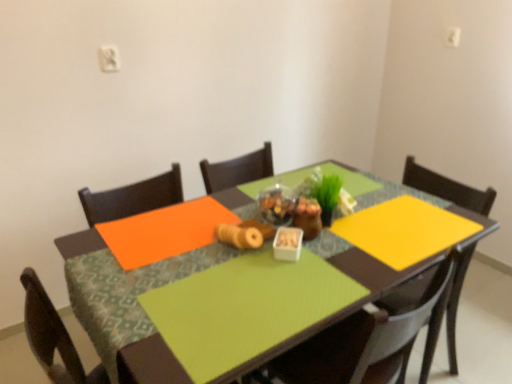
Measure the distance between matte brown chair at center and camera.

They are 34.06 inches apart.

I want to click on white matte container at center, so click(x=287, y=244).

What do you see at coordinates (325, 189) in the screenshot? I see `green matte plant at center` at bounding box center [325, 189].

Where is `matte brown chair at center`? Image resolution: width=512 pixels, height=384 pixels. matte brown chair at center is located at coordinates (365, 342).

Which object is positioned more to the left, matte brown chair at center or green matte plant at center?

green matte plant at center is more to the left.

Does matte brown chair at center lie in front of green matte plant at center?

That is True.

Which of these two, matte brown chair at center or green matte plant at center, is smaller?

green matte plant at center is smaller.

From a real-world perspective, which object rests below the other?

From a 3D spatial view, white matte container at center is below.

I want to click on tableware that is on the left side of green matte plant at center, so click(287, 244).

Who is taller, green matte plant at center or white matte container at center?

green matte plant at center is taller.

How much distance is there between green matte plant at center and white matte container at center?

green matte plant at center and white matte container at center are 17.67 centimeters apart from each other.

From a real-world perspective, which is physically above, matte brown chair at center or green fabric table at center?

matte brown chair at center is physically above.

From the image's perspective, between matte brown chair at center and green fabric table at center, who is located below?

matte brown chair at center.

Do you think matte brown chair at center is within green fabric table at center, or outside of it?

matte brown chair at center exists entirely within green fabric table at center.

Which is behind, point (335, 374) or point (146, 342)?

Point (335, 374)

The image size is (512, 384). I want to click on plant above the green fabric table at center (from the image's perspective), so [325, 189].

In the image, is green matte plant at center positioned in front of or behind green fabric table at center?

green matte plant at center is positioned farther from the viewer than green fabric table at center.

Could you tell me if green matte plant at center is facing green fabric table at center?

No, green matte plant at center is not facing towards green fabric table at center.

Can you see white matte container at center touching green matte plant at center?

No, white matte container at center is not next to green matte plant at center.

How different are the orientations of white matte container at center and green matte plant at center in degrees?

The facing directions of white matte container at center and green matte plant at center are 17.6 degrees apart.

Consider the image. Does white matte container at center have a greater height compared to green matte plant at center?

Incorrect, the height of white matte container at center is not larger of that of green matte plant at center.

Could you tell me if white matte container at center is turned towards green matte plant at center?

No, white matte container at center does not turn towards green matte plant at center.

Is green fabric table at center facing away from matte brown chair at center?

Yes, matte brown chair at center is at the back of green fabric table at center.

Locate an element on the screen. chair above the green fabric table at center (from a real-world perspective) is located at coordinates (365, 342).

Which object is more forward, green fabric table at center or matte brown chair at center?

green fabric table at center is more forward.

Does green fabric table at center appear on the left side of matte brown chair at center?

Indeed, green fabric table at center is positioned on the left side of matte brown chair at center.

Consider the image. From the image's perspective, which is below, green matte plant at center or matte brown chair at center?

matte brown chair at center, from the image's perspective.

Considering the sizes of objects green matte plant at center and matte brown chair at center in the image provided, who is shorter, green matte plant at center or matte brown chair at center?

With less height is green matte plant at center.

Does green matte plant at center have a larger size compared to matte brown chair at center?

No, green matte plant at center is not bigger than matte brown chair at center.

Does green matte plant at center contain matte brown chair at center?

No, matte brown chair at center is not inside green matte plant at center.

The height and width of the screenshot is (384, 512). Identify the location of plant that appears above the matte brown chair at center (from a real-world perspective). (325, 189).

At what (x,y) coordinates should I click in order to perform the action: click on tableware located on the left of green matte plant at center. Please return your answer as a coordinate pair (x, y). This screenshot has height=384, width=512. Looking at the image, I should click on (287, 244).

Considering their positions, is white matte container at center positioned closer to green matte plant at center than green fabric table at center?

Among the two, white matte container at center is located nearer to green matte plant at center.

Based on their spatial positions, is matte brown chair at center or white matte container at center closer to green fabric table at center?

matte brown chair at center lies closer to green fabric table at center than the other object.

When comparing their distances from green fabric table at center, does white matte container at center or green matte plant at center seem closer?

The object closer to green fabric table at center is white matte container at center.

Considering their positions, is green matte plant at center positioned closer to green fabric table at center than matte brown chair at center?

Among the two, matte brown chair at center is located nearer to green fabric table at center.

Estimate the real-world distances between objects in this image. Which object is further from green matte plant at center, white matte container at center or matte brown chair at center?

matte brown chair at center is positioned further to the anchor green matte plant at center.

Considering their positions, is matte brown chair at center positioned further to green matte plant at center than white matte container at center?

The object further to green matte plant at center is matte brown chair at center.

Estimate the real-world distances between objects in this image. Which object is further from green fabric table at center, matte brown chair at center or green matte plant at center?

green matte plant at center.

Looking at the image, which one is located further to white matte container at center, green fabric table at center or matte brown chair at center?

Among the two, matte brown chair at center is located further to white matte container at center.

Identify the location of table between white matte container at center and matte brown chair at center vertically. This screenshot has height=384, width=512. (150, 365).

This screenshot has width=512, height=384. Identify the location of tableware located between green fabric table at center and green matte plant at center in the depth direction. (287, 244).

I want to click on tableware between green matte plant at center and matte brown chair at center vertically, so click(x=287, y=244).

Locate an element on the screen. The height and width of the screenshot is (384, 512). table between green matte plant at center and matte brown chair at center in the up-down direction is located at coordinates (150, 365).